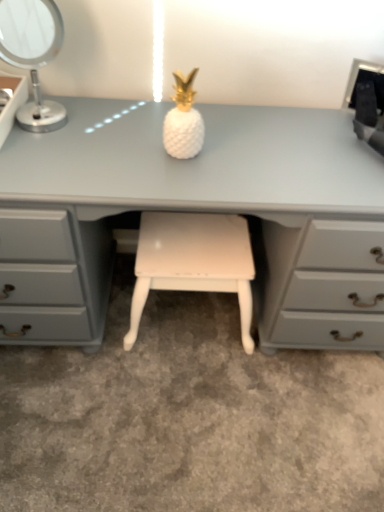
What are the coordinates of `vacant space in front of white painted wood stool at center` in the screenshot? It's located at (179, 408).